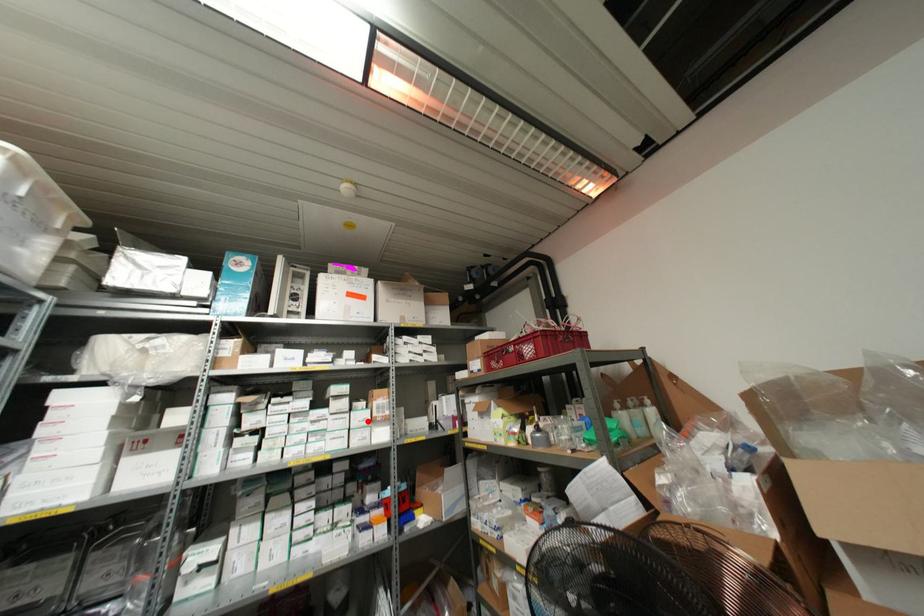
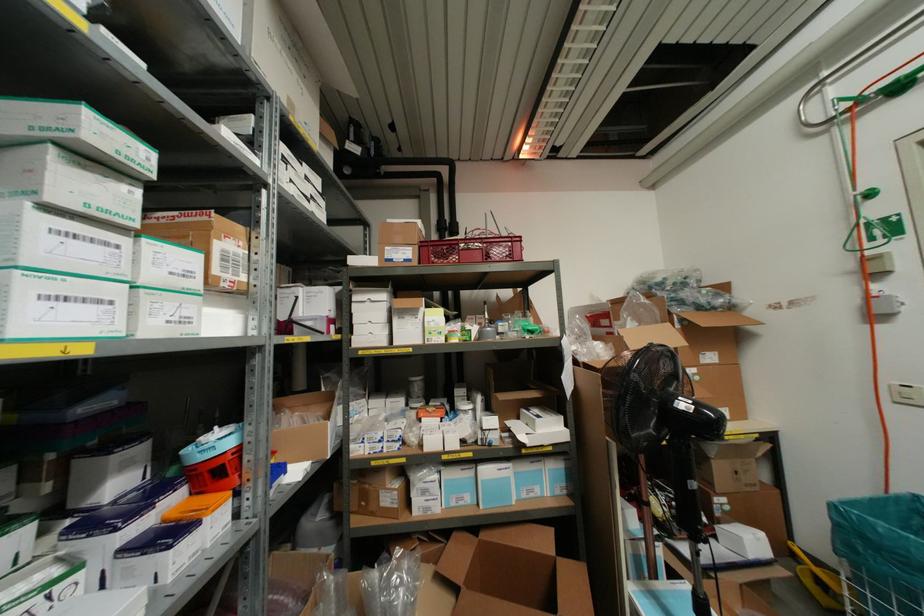
Where in the second image is the point corresponding to the highlighted location from the first image?

(196, 283)